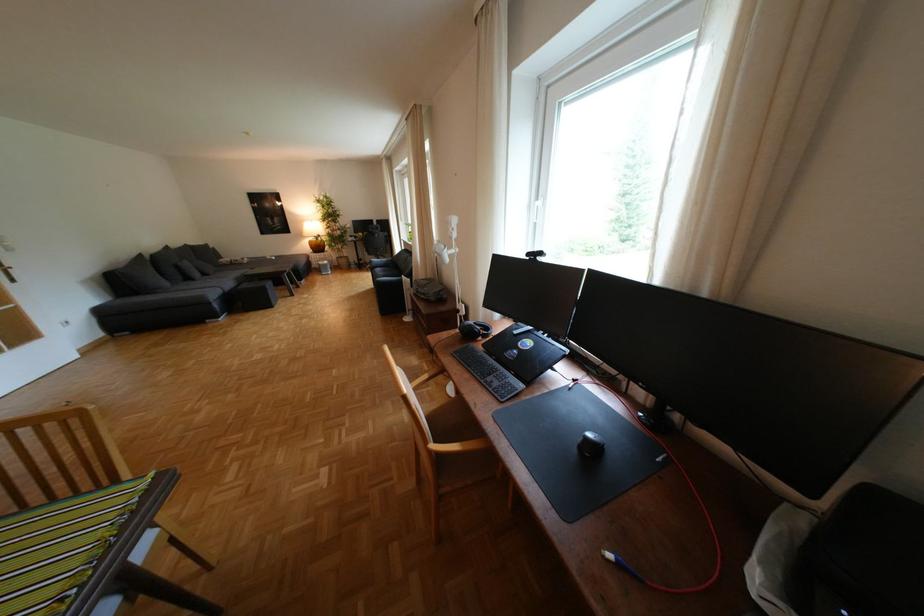
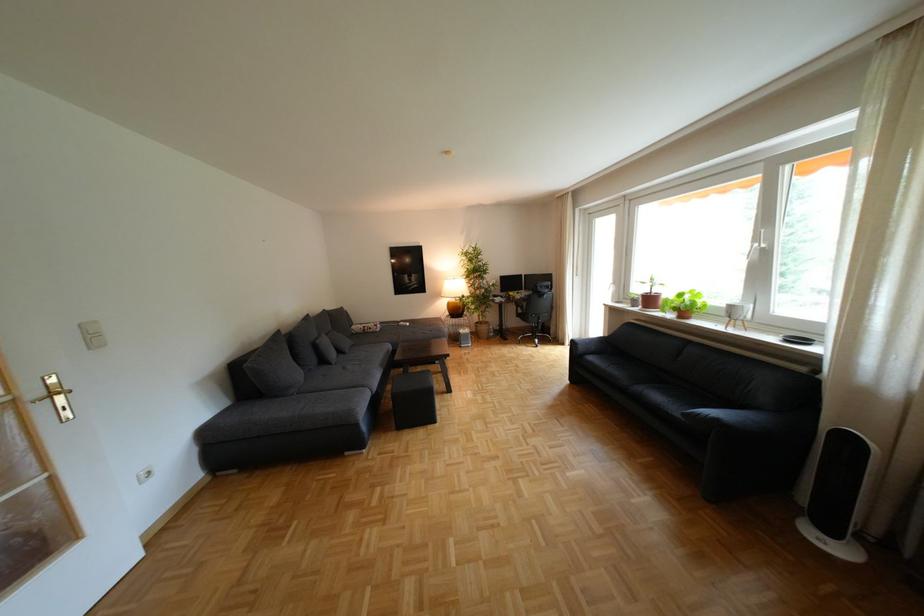
What movement of the cameraman would produce the second image?

The cameraman moved toward left, forward.